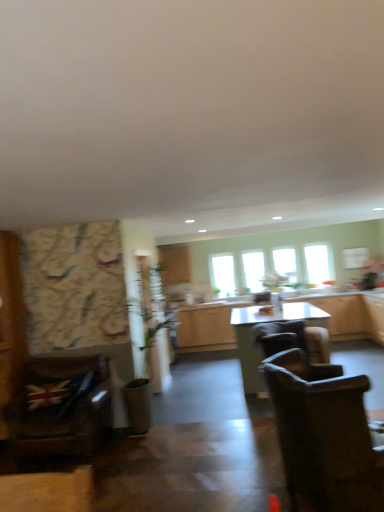
Question: Should I look upward or downward to see transparent glass window at center, which appears as the second window when viewed from the left?

Choices:
 (A) down
 (B) up

Answer: (A)

Question: Does matte wood cabinetry at center, arranged as the 2th cabinetry when viewed from the right, appear on the right side of wooden cabinets at center, placed as the second cabinetry when sorted from top to bottom?

Choices:
 (A) no
 (B) yes

Answer: (A)

Question: From the image's perspective, is matte wood cabinetry at center, which is counted as the second cabinetry, starting from the bottom, located beneath wooden cabinets at center, placed as the second cabinetry when sorted from top to bottom?

Choices:
 (A) no
 (B) yes

Answer: (A)

Question: Is matte wood cabinetry at center, the first cabinetry when ordered from top to bottom, looking in the opposite direction of wooden cabinets at center, the first cabinetry viewed from the right?

Choices:
 (A) no
 (B) yes

Answer: (A)

Question: Is the position of matte wood cabinetry at center, arranged as the 2th cabinetry when viewed from the right, more distant than that of wooden cabinets at center, marked as the second cabinetry in a left-to-right arrangement?

Choices:
 (A) yes
 (B) no

Answer: (A)

Question: Is matte wood cabinetry at center, which is counted as the second cabinetry, starting from the bottom, in front of wooden cabinets at center, which ranks as the 1th cabinetry in bottom-to-top order?

Choices:
 (A) yes
 (B) no

Answer: (B)

Question: From the image's perspective, is matte wood cabinetry at center, the 1th cabinetry viewed from the left, located above wooden cabinets at center, marked as the second cabinetry in a left-to-right arrangement?

Choices:
 (A) yes
 (B) no

Answer: (A)

Question: Would you say brown leather chair at center, the third chair in the left-to-right sequence, contains transparent glass window at center, which appears as the second window when viewed from the left?

Choices:
 (A) yes
 (B) no

Answer: (B)

Question: Is brown leather chair at center, the 1th chair when ordered from right to left, positioned with its back to transparent glass window at center, which appears as the second window when viewed from the left?

Choices:
 (A) yes
 (B) no

Answer: (B)

Question: From a real-world perspective, is brown leather chair at center, marked as the 3th chair in a front-to-back arrangement, on top of transparent glass window at center, which appears as the second window when viewed from the left?

Choices:
 (A) yes
 (B) no

Answer: (B)

Question: Considering the relative sizes of brown leather chair at center, the third chair in the left-to-right sequence, and transparent glass window at center, which appears as the 3th window when viewed from the right, in the image provided, is brown leather chair at center, the third chair in the left-to-right sequence, thinner than transparent glass window at center, which appears as the 3th window when viewed from the right,?

Choices:
 (A) no
 (B) yes

Answer: (A)

Question: Is brown leather chair at center, the third chair in the left-to-right sequence, in front of transparent glass window at center, which appears as the second window when viewed from the left?

Choices:
 (A) yes
 (B) no

Answer: (A)

Question: Could you tell me if brown leather chair at center, marked as the 3th chair in a front-to-back arrangement, is facing transparent glass window at center, which appears as the 3th window when viewed from the right?

Choices:
 (A) yes
 (B) no

Answer: (B)

Question: Is green leafy plant at center to the left of transparent glass window at upper right, the 1th window in the right-to-left sequence, from the viewer's perspective?

Choices:
 (A) no
 (B) yes

Answer: (B)